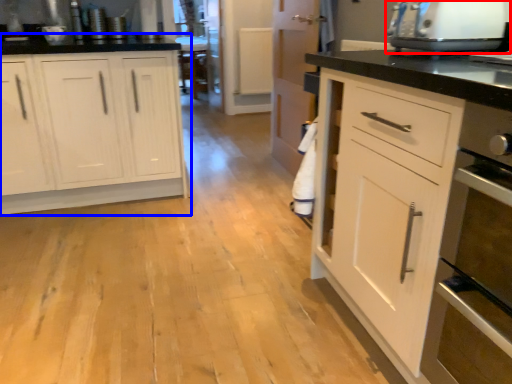
Question: Which of the following is the farthest to the observer, home appliance (highlighted by a red box) or cabinetry (highlighted by a blue box)?

Choices:
 (A) home appliance
 (B) cabinetry

Answer: (B)